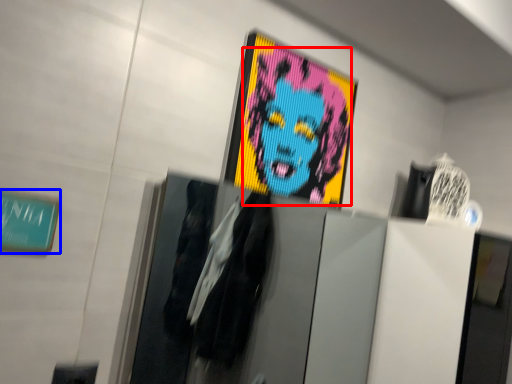
Question: Among these objects, which one is nearest to the camera, person (highlighted by a red box) or poster (highlighted by a blue box)?

Choices:
 (A) person
 (B) poster

Answer: (B)